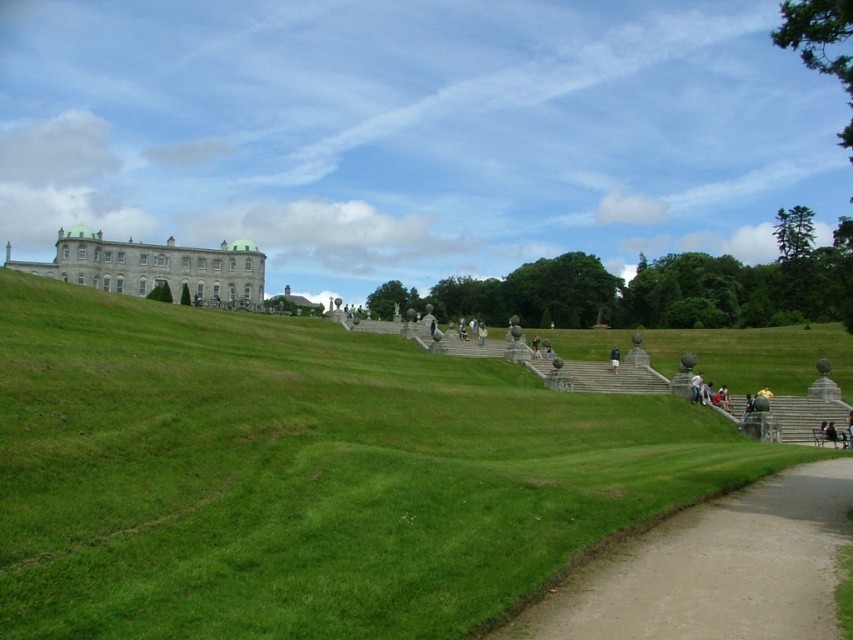
Does dirt/gravel path at lower right appear under dark blue jeans at center?

Indeed, dirt/gravel path at lower right is positioned under dark blue jeans at center.

Who is lower down, dirt/gravel path at lower right or dark blue jeans at center?

Positioned lower is dirt/gravel path at lower right.

Between point (769, 589) and point (614, 356), which one is positioned behind?

The point (614, 356) is behind.

The image size is (853, 640). Find the location of `dirt/gravel path at lower right`. dirt/gravel path at lower right is located at coordinates (714, 570).

Does green grassy at upper center have a lesser width compared to dark blue jeans at center?

No, green grassy at upper center is not thinner than dark blue jeans at center.

Does green grassy at upper center have a greater width compared to dark blue jeans at center?

Indeed, green grassy at upper center has a greater width compared to dark blue jeans at center.

Identify the location of green grassy at upper center. (305, 474).

Does white stone palace at upper left appear on the left side of dark blue jeans at center?

Correct, you'll find white stone palace at upper left to the left of dark blue jeans at center.

Is point (131, 276) more distant than point (610, 365)?

That is True.

This screenshot has width=853, height=640. Identify the location of white stone palace at upper left. (154, 268).